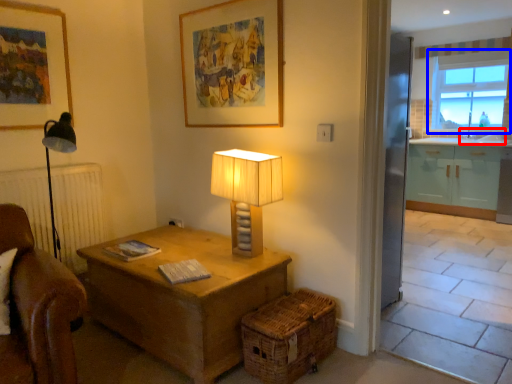
Question: Which point is closer to the camera, sink (highlighted by a red box) or window (highlighted by a blue box)?

Choices:
 (A) sink
 (B) window

Answer: (A)